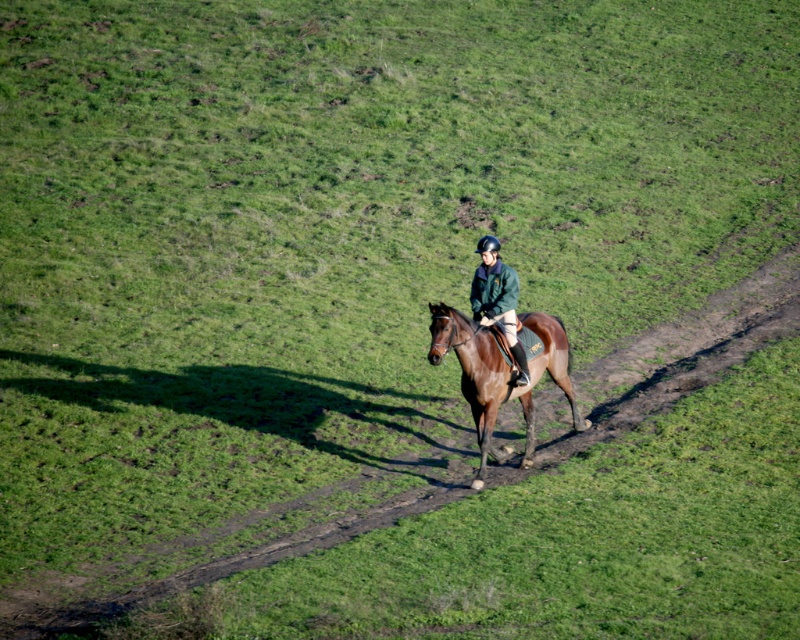
You are a photographer trying to capture the rider and horse in the image. You want to position your camera so that the green matte jacket at center is on the left side of the frame and the brown glossy horse at center is on the right side. Is this possible based on their current positions?

Yes, because the brown glossy horse at center is already positioned to the right of the green matte jacket at center, aligning with your desired composition.

You are a photographer positioned at the origin point of the image. You want to capture a photo of the brown glossy horse at center. According to the coordinates provided, where should you aim your camera to ensure the horse is centered in the frame?

You should aim your camera at the coordinates point (500, 372) to center the brown glossy horse at center in the frame.

You are a photographer trying to capture a clear photo of the green matte jacket at center while the brown glossy horse at center is moving. To avoid the horse blocking the jacket, where should you position yourself relative to the horse and jacket?

Since the brown glossy horse at center is in front of the green matte jacket at center, you should position yourself behind the horse so that the jacket is visible behind it.